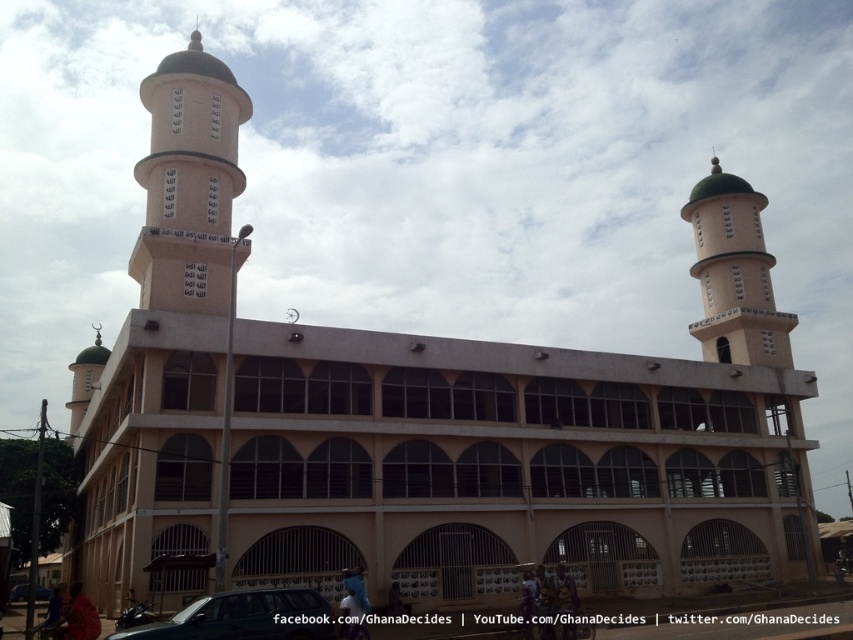
Question: Among these objects, which one is nearest to the camera?

Choices:
 (A) matte white minaret at left
 (B) white textured tower at center-left
 (C) matte beige tower at upper right

Answer: (B)

Question: Which of the following is the closest to the observer?

Choices:
 (A) (35, 586)
 (B) (213, 292)

Answer: (B)

Question: Where is white textured tower at center-left located in relation to matte beige tower at upper right in the image?

Choices:
 (A) right
 (B) left

Answer: (B)

Question: Can you confirm if matte beige tower at upper right is positioned above matte white minaret at left?

Choices:
 (A) yes
 (B) no

Answer: (A)

Question: Which point is closer to the camera taking this photo?

Choices:
 (A) (x=149, y=112)
 (B) (x=758, y=349)
 (C) (x=296, y=589)
 (D) (x=25, y=595)

Answer: (C)

Question: Does white textured tower at center-left appear on the right side of metallic car at center?

Choices:
 (A) yes
 (B) no

Answer: (B)